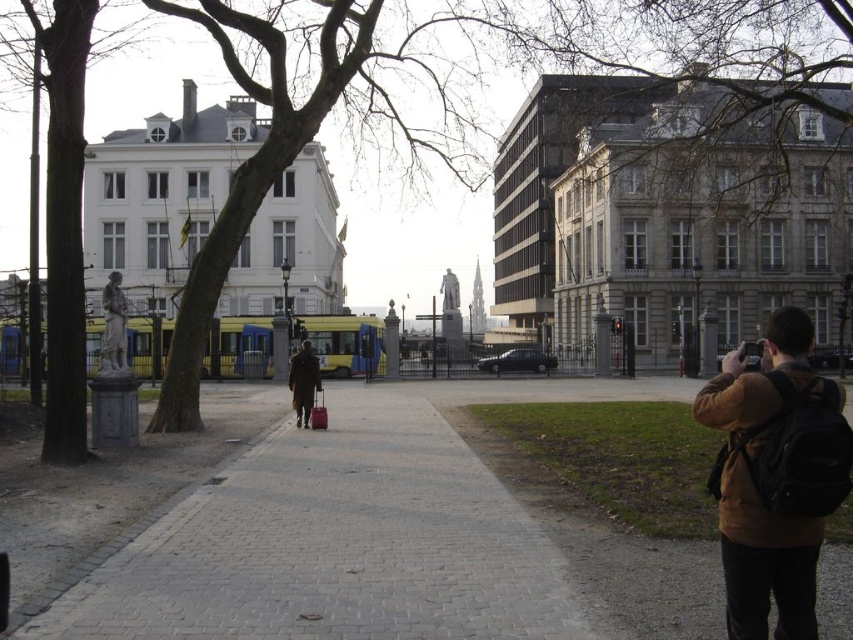
You are a fashion designer observing the scene and want to compare the two leather garments. Which one is taller between the brown leather jacket at lower right and the brown leather coat at center?

The brown leather jacket at lower right is taller than the brown leather coat at center according to the description.

You are standing at the entrance of the scene and want to walk to the statue. According to the coordinates provided, where should you look to find the gray brick pavement at center?

The gray brick pavement at center is located at coordinates point [393,541], so you should look towards that point to find it.